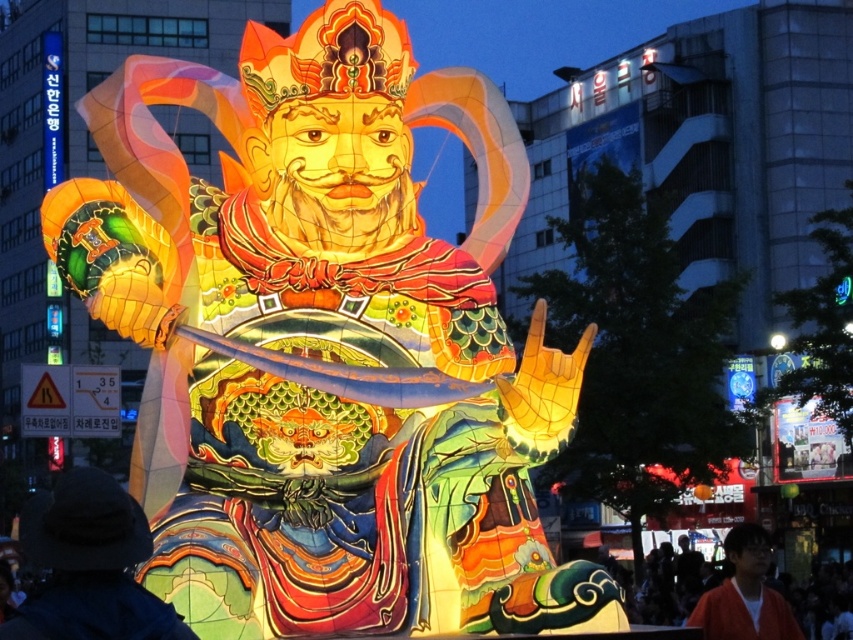
How much distance is there between dark blue fabric hat at lower left and orange fabric shirt at lower right?

dark blue fabric hat at lower left and orange fabric shirt at lower right are 34.77 meters apart.

Can you confirm if dark blue fabric hat at lower left is positioned to the right of orange fabric shirt at lower right?

Incorrect, dark blue fabric hat at lower left is not on the right side of orange fabric shirt at lower right.

Between point (103, 544) and point (781, 627), which one is positioned behind?

Point (781, 627)

Locate an element on the screen. dark blue fabric hat at lower left is located at coordinates (88, 564).